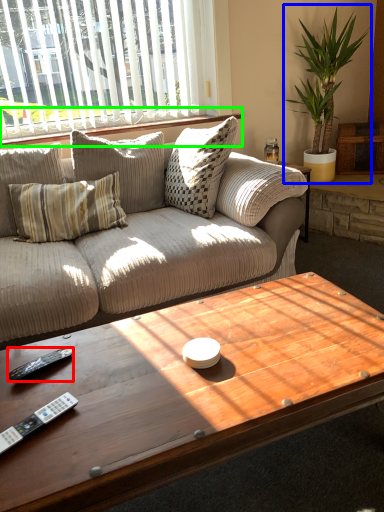
Question: Estimate the real-world distances between objects in this image. Which object is closer to remote (highlighted by a red box), houseplant (highlighted by a blue box) or window sill (highlighted by a green box)?

Choices:
 (A) houseplant
 (B) window sill

Answer: (B)